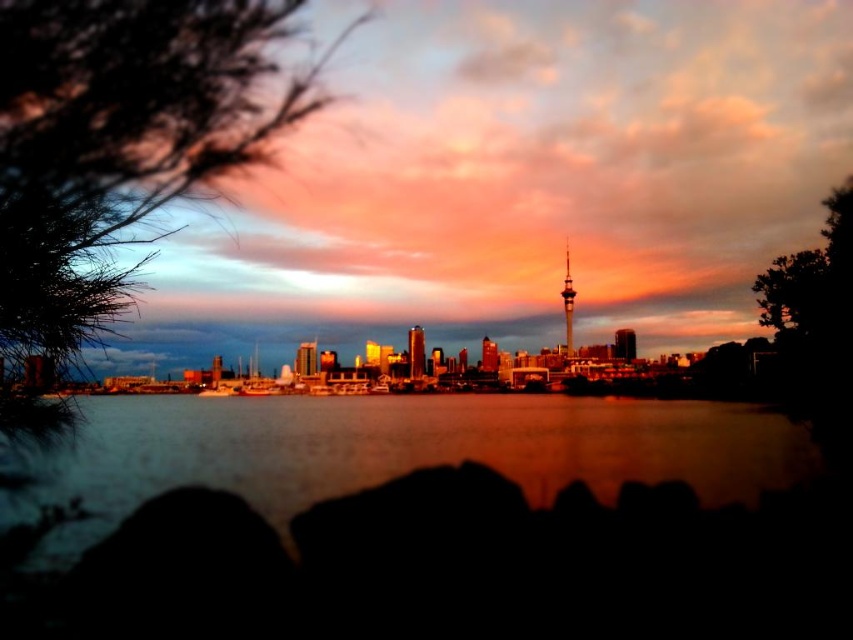
Looking at this image, you are a bird flying between the green leafy tree at left and the dark green leafy tree at right. Which tree is closer to the city skyline in the midground?

The green leafy tree at left is closer to the city skyline in the midground because it is only 516.01 meters away from the dark green leafy tree at right, but the distance to the skyline isn

You are standing on a boat in the middle of the water, looking at the city skyline. There are two points marked on the horizon. The first point is at coordinates point (791,316) and the second is at point (567,289). Which of these two points is closer to you?

Point (791,316) is closer to you because it is further to the viewer than point (567,289).